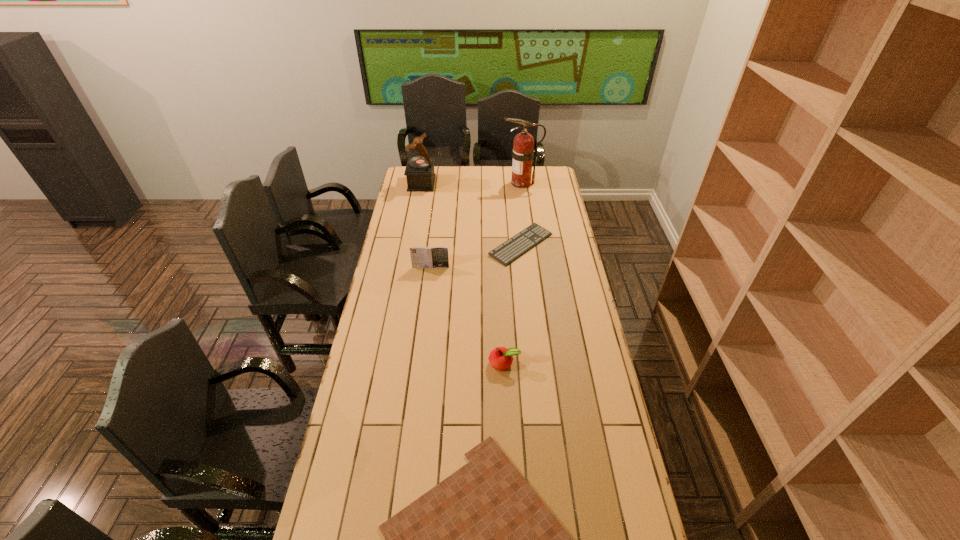
I want to click on vacant space located 0.180m on the front cover of the book, so click(x=427, y=296).

The height and width of the screenshot is (540, 960). Find the location of `free space located 0.220m on the left of the third shortest object`. free space located 0.220m on the left of the third shortest object is located at coordinates (429, 363).

Where is `vacant position located on the left of the second shortest object`? This screenshot has height=540, width=960. vacant position located on the left of the second shortest object is located at coordinates (444, 245).

You are a GUI agent. You are given a task and a screenshot of the screen. Output one action in this format:
    pyautogui.click(x=<x>, y=<y>)
    Task: Click on the fire extinguisher present at the far edge
    The width and height of the screenshot is (960, 540).
    Given the screenshot: What is the action you would take?
    pyautogui.click(x=523, y=152)

The width and height of the screenshot is (960, 540). In order to click on phonograph_record at the far edge in this screenshot , I will do `click(419, 171)`.

The height and width of the screenshot is (540, 960). I want to click on phonograph_record that is positioned at the left edge, so click(x=419, y=171).

At what (x,y) coordinates should I click in order to perform the action: click on book that is at the left edge. Please return your answer as a coordinate pair (x, y). Looking at the image, I should click on (437, 256).

Locate an element on the screen. fire extinguisher present at the right edge is located at coordinates (523, 152).

Identify the location of computer keyboard situated at the right edge. (513, 248).

The height and width of the screenshot is (540, 960). Find the location of `object that is at the far left corner`. object that is at the far left corner is located at coordinates (419, 171).